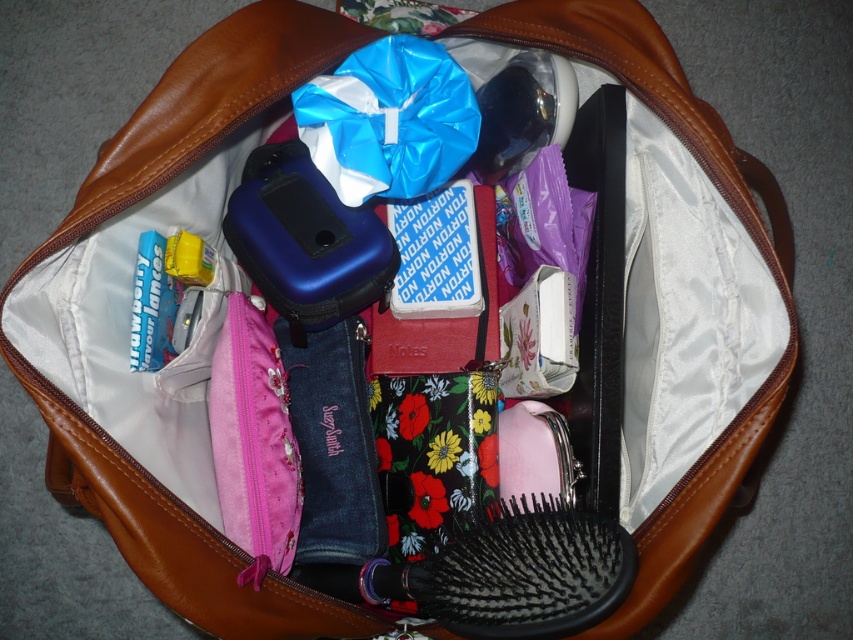
Who is taller, black plastic hairbrush at center or blue shiny plastic bag at center?

Standing taller between the two is blue shiny plastic bag at center.

Between black plastic hairbrush at center and blue shiny plastic bag at center, which one is positioned lower?

black plastic hairbrush at center is below.

Identify the location of black plastic hairbrush at center. This screenshot has height=640, width=853. (521, 572).